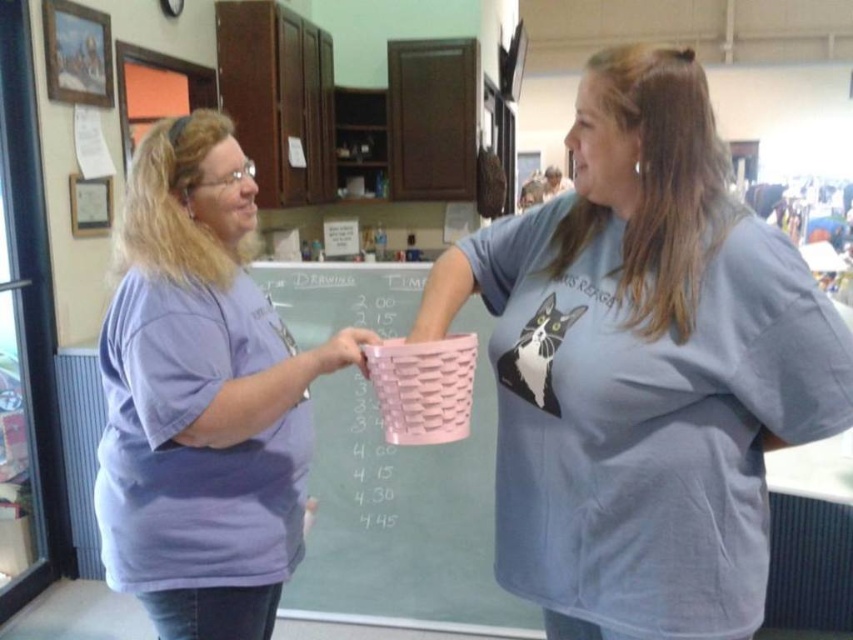
Question: Which of these objects is positioned closest to the purple matte shirt at left?

Choices:
 (A) pink woven basket at center
 (B) matte pink basket at center

Answer: (B)

Question: Estimate the real-world distances between objects in this image. Which object is closer to the pink woven basket at center?

Choices:
 (A) matte pink basket at center
 (B) purple matte shirt at left

Answer: (B)

Question: Is the position of matte pink basket at center more distant than that of pink woven basket at center?

Choices:
 (A) yes
 (B) no

Answer: (B)

Question: Can you confirm if matte pink basket at center is positioned to the right of purple matte shirt at left?

Choices:
 (A) yes
 (B) no

Answer: (A)

Question: Is purple matte shirt at left to the right of pink woven basket at center from the viewer's perspective?

Choices:
 (A) yes
 (B) no

Answer: (B)

Question: Which of the following is the farthest from the observer?

Choices:
 (A) (503, 390)
 (B) (113, 573)

Answer: (B)